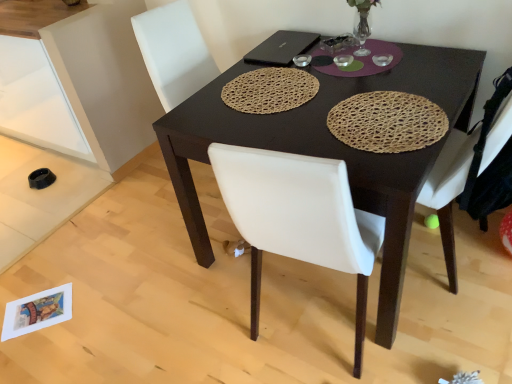
Question: From the image's perspective, is matte white cabinet at lower left located above black matte laptop at upper center?

Choices:
 (A) yes
 (B) no

Answer: (A)

Question: From the image's perspective, is matte white cabinet at lower left beneath black matte laptop at upper center?

Choices:
 (A) yes
 (B) no

Answer: (B)

Question: Considering the relative sizes of matte white cabinet at lower left and black matte laptop at upper center in the image provided, is matte white cabinet at lower left shorter than black matte laptop at upper center?

Choices:
 (A) yes
 (B) no

Answer: (B)

Question: Does matte white cabinet at lower left turn towards black matte laptop at upper center?

Choices:
 (A) no
 (B) yes

Answer: (A)

Question: Is matte white cabinet at lower left thinner than black matte laptop at upper center?

Choices:
 (A) yes
 (B) no

Answer: (B)

Question: From a real-world perspective, is matte white cabinet at lower left beneath black matte laptop at upper center?

Choices:
 (A) no
 (B) yes

Answer: (B)

Question: Does black matte laptop at upper center come behind woven brown placemat at center, the 2th mat from the right?

Choices:
 (A) yes
 (B) no

Answer: (A)

Question: From a real-world perspective, does black matte laptop at upper center sit lower than woven brown placemat at center, the 1th mat positioned from the left?

Choices:
 (A) no
 (B) yes

Answer: (A)

Question: Can you confirm if black matte laptop at upper center is taller than woven brown placemat at center, the 2th mat from the right?

Choices:
 (A) no
 (B) yes

Answer: (A)

Question: Does black matte laptop at upper center touch woven brown placemat at center, the 1th mat positioned from the left?

Choices:
 (A) no
 (B) yes

Answer: (A)

Question: Are black matte laptop at upper center and woven brown placemat at center, the 2th mat from the right, located far from each other?

Choices:
 (A) yes
 (B) no

Answer: (B)

Question: From a real-world perspective, is black matte laptop at upper center located higher than woven brown placemat at center, the 2th mat from the right?

Choices:
 (A) yes
 (B) no

Answer: (A)

Question: Is black matte laptop at upper center far from dark brown wooden desk at center?

Choices:
 (A) no
 (B) yes

Answer: (A)